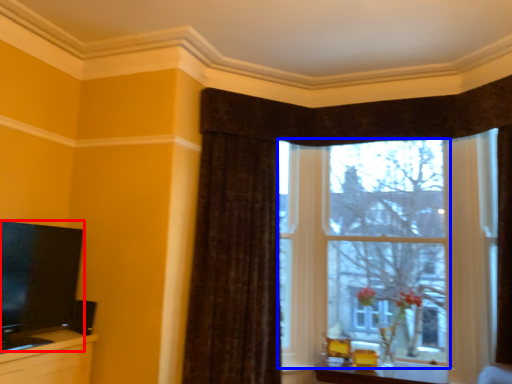
Question: Which object appears farthest to the camera in this image, television (highlighted by a red box) or window (highlighted by a blue box)?

Choices:
 (A) television
 (B) window

Answer: (B)